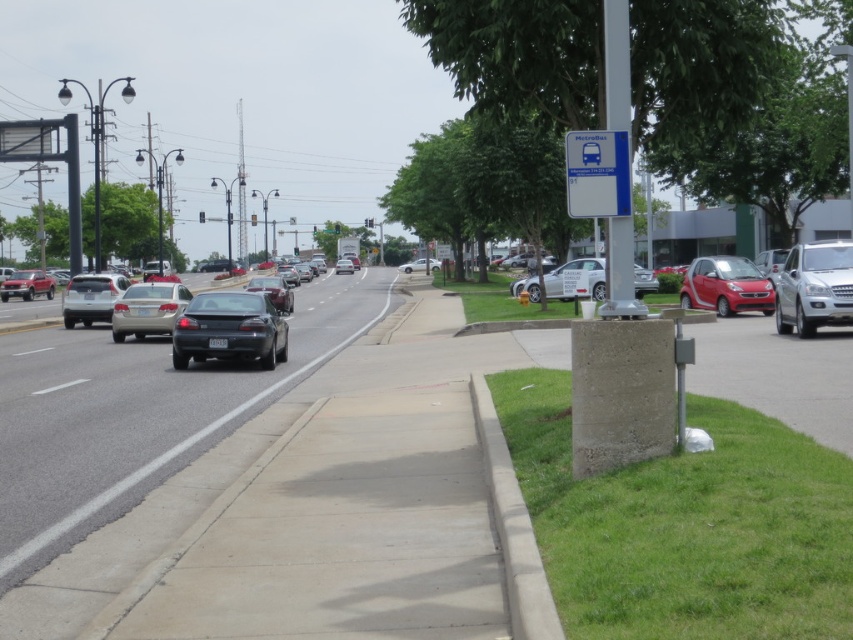
Question: Which point appears farthest from the camera in this image?

Choices:
 (A) (288, 310)
 (B) (257, 312)
 (C) (412, 268)

Answer: (C)

Question: Does blue plastic bus stop sign at upper right have a lesser width compared to satin black sedan at center?

Choices:
 (A) no
 (B) yes

Answer: (B)

Question: Which object is positioned closest to the shiny black sedan at center?

Choices:
 (A) gray concrete sidewalk at center
 (B) satin silver suv at left

Answer: (A)

Question: Which object is positioned farthest from the matte gold sedan at center-left?

Choices:
 (A) satin silver suv at left
 (B) shiny dark gray sedan at center
 (C) gray concrete sidewalk at center
 (D) gray concrete curb at lower right

Answer: (D)

Question: Does shiny dark gray sedan at center have a smaller size compared to matte red truck at left?

Choices:
 (A) yes
 (B) no

Answer: (A)

Question: Can you confirm if blue plastic bus stop sign at upper right is thinner than matte gold sedan at center-left?

Choices:
 (A) no
 (B) yes

Answer: (B)